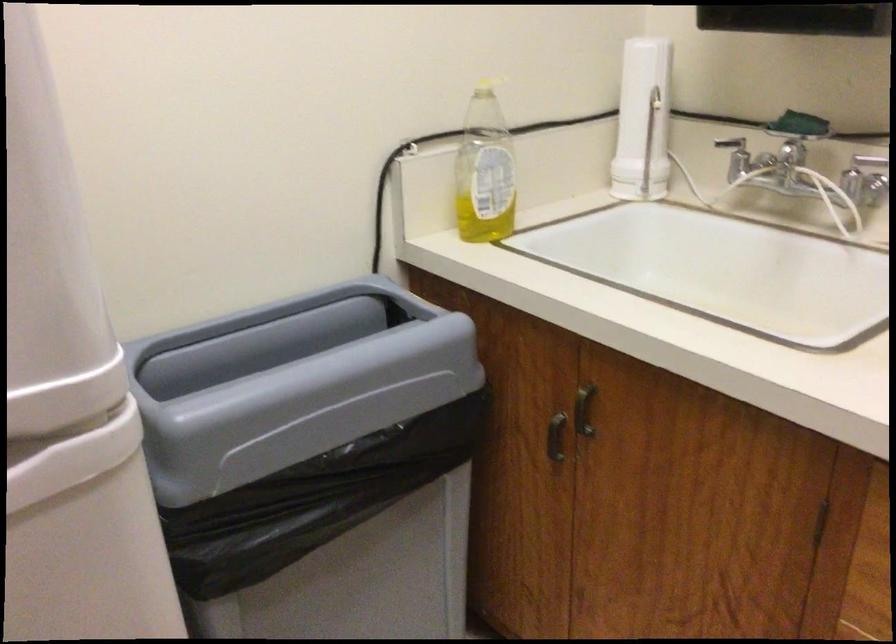
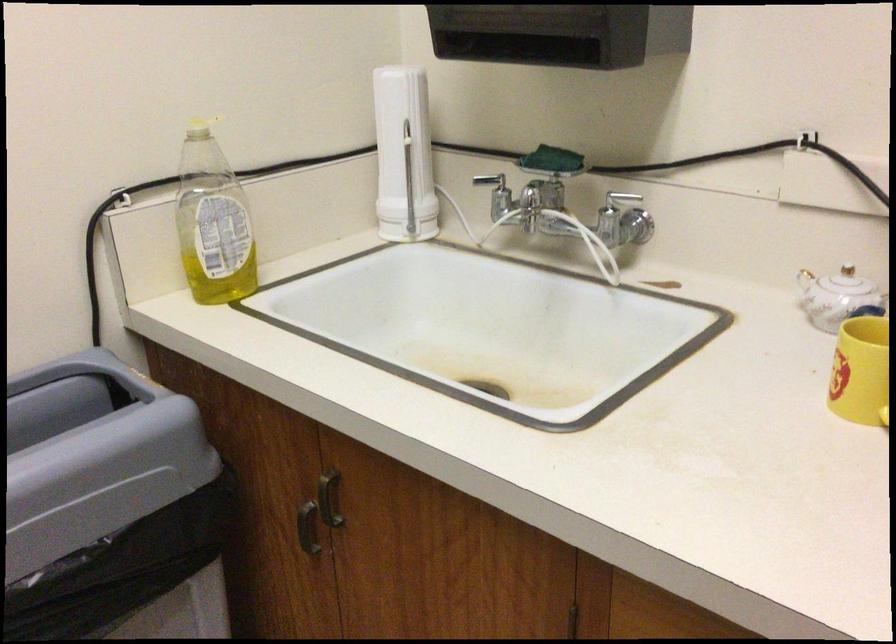
Where in the second image is the point corresponding to [800,122] from the first image?

(552, 160)